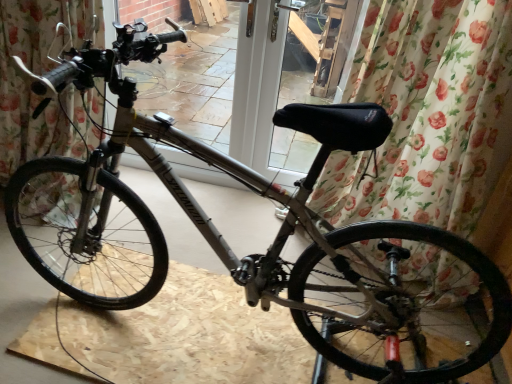
Question: Is the position of matte black handlebars at upper center less distant than that of matte gray bicycle at center?

Choices:
 (A) no
 (B) yes

Answer: (A)

Question: From the image's perspective, is matte black handlebars at upper center located above matte gray bicycle at center?

Choices:
 (A) no
 (B) yes

Answer: (B)

Question: Is matte black handlebars at upper center to the left of matte gray bicycle at center from the viewer's perspective?

Choices:
 (A) yes
 (B) no

Answer: (A)

Question: Considering the relative positions of matte black handlebars at upper center and matte gray bicycle at center in the image provided, is matte black handlebars at upper center to the right of matte gray bicycle at center from the viewer's perspective?

Choices:
 (A) yes
 (B) no

Answer: (B)

Question: Can we say matte black handlebars at upper center lies outside matte gray bicycle at center?

Choices:
 (A) no
 (B) yes

Answer: (B)

Question: Is point click(x=202, y=100) positioned closer to the camera than point click(x=490, y=137)?

Choices:
 (A) closer
 (B) farther

Answer: (B)

Question: From the image's perspective, is matte black handlebars at upper center positioned above or below floral fabric curtain at center, marked as the first curtain in a right-to-left arrangement?

Choices:
 (A) above
 (B) below

Answer: (A)

Question: Based on their positions, is matte black handlebars at upper center located to the left or right of floral fabric curtain at center, the 2th curtain from the left?

Choices:
 (A) left
 (B) right

Answer: (A)

Question: Would you say matte black handlebars at upper center is inside or outside floral fabric curtain at center, the 2th curtain from the left?

Choices:
 (A) outside
 (B) inside

Answer: (A)

Question: Visually, is matte gray bicycle at center positioned to the left or to the right of floral fabric curtain at center, the 2th curtain from the left?

Choices:
 (A) left
 (B) right

Answer: (A)

Question: From a real-world perspective, relative to floral fabric curtain at center, the 2th curtain from the left, is matte gray bicycle at center vertically above or below?

Choices:
 (A) above
 (B) below

Answer: (B)

Question: In terms of size, does matte gray bicycle at center appear bigger or smaller than floral fabric curtain at center, the 2th curtain from the left?

Choices:
 (A) small
 (B) big

Answer: (A)

Question: Choose the correct answer: Is matte gray bicycle at center inside floral fabric curtain at center, marked as the first curtain in a right-to-left arrangement, or outside it?

Choices:
 (A) inside
 (B) outside

Answer: (B)

Question: From a real-world perspective, is floral fabric curtain at center, the 2th curtain from the left, physically located above or below matte gray bicycle at center?

Choices:
 (A) below
 (B) above

Answer: (B)

Question: In the image, is floral fabric curtain at center, the 2th curtain from the left, positioned in front of or behind matte gray bicycle at center?

Choices:
 (A) behind
 (B) front

Answer: (A)